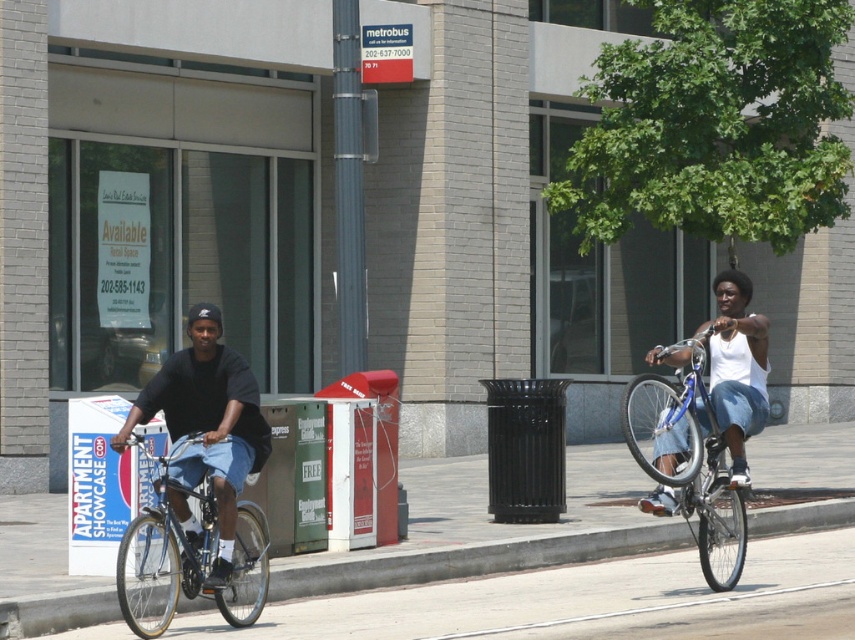
Question: Can you confirm if matte black shirt at left is positioned below shiny blue bicycle at right?

Choices:
 (A) yes
 (B) no

Answer: (B)

Question: Does matte black shirt at left have a lesser width compared to shiny blue bicycle at right?

Choices:
 (A) yes
 (B) no

Answer: (A)

Question: Which of the following is the closest to the observer?

Choices:
 (A) (634, 538)
 (B) (187, 394)

Answer: (B)

Question: Among these objects, which one is farthest from the camera?

Choices:
 (A) shiny blue bicycle at right
 (B) gray concrete curb at lower left
 (C) matte black shirt at left
 (D) silver metallic bicycle at left

Answer: (B)

Question: Which of the following is the farthest from the observer?

Choices:
 (A) (234, 589)
 (B) (204, 385)

Answer: (B)

Question: Can you confirm if gray concrete curb at lower left is positioned above shiny blue bicycle at right?

Choices:
 (A) yes
 (B) no

Answer: (B)